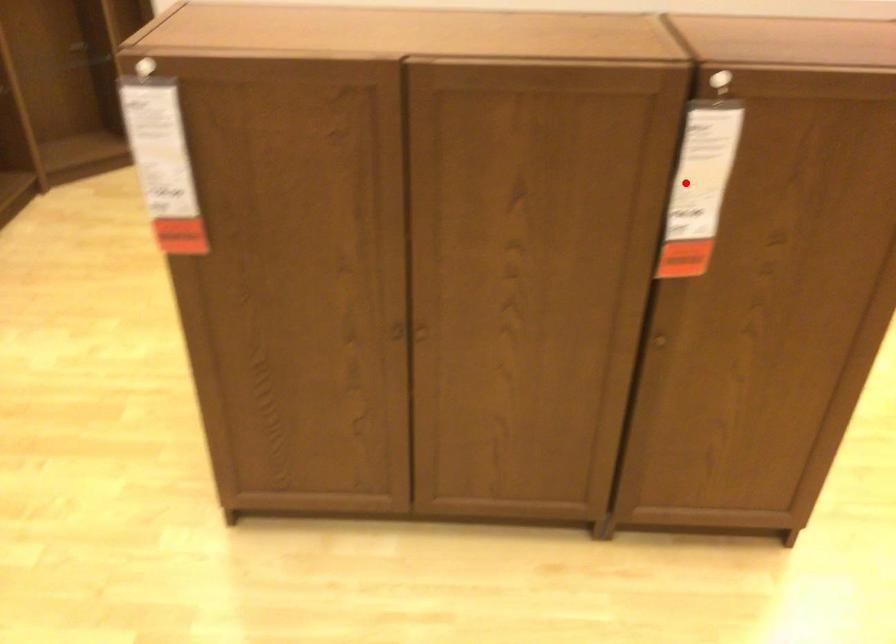
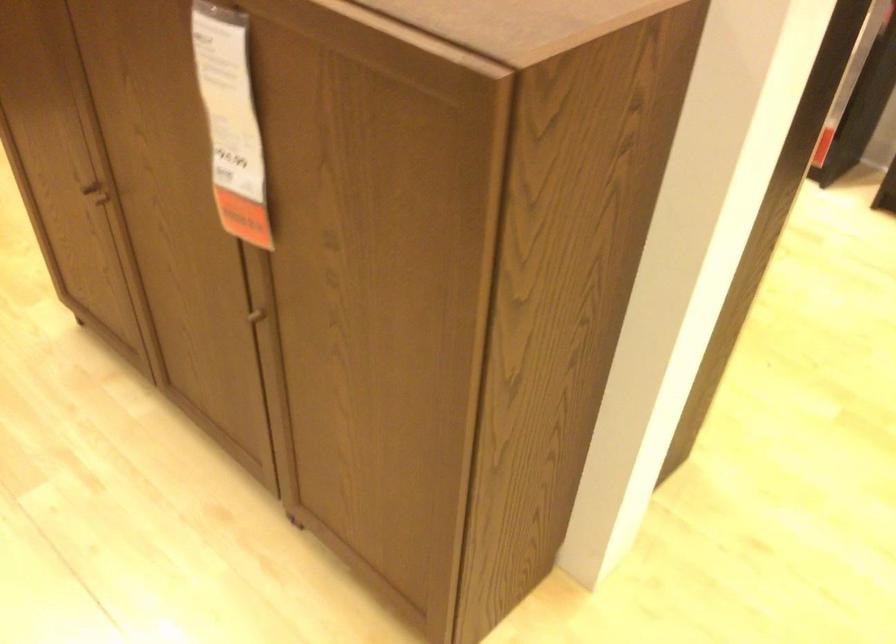
Locate, in the second image, the point that corresponds to the highlighted location in the first image.

(230, 122)